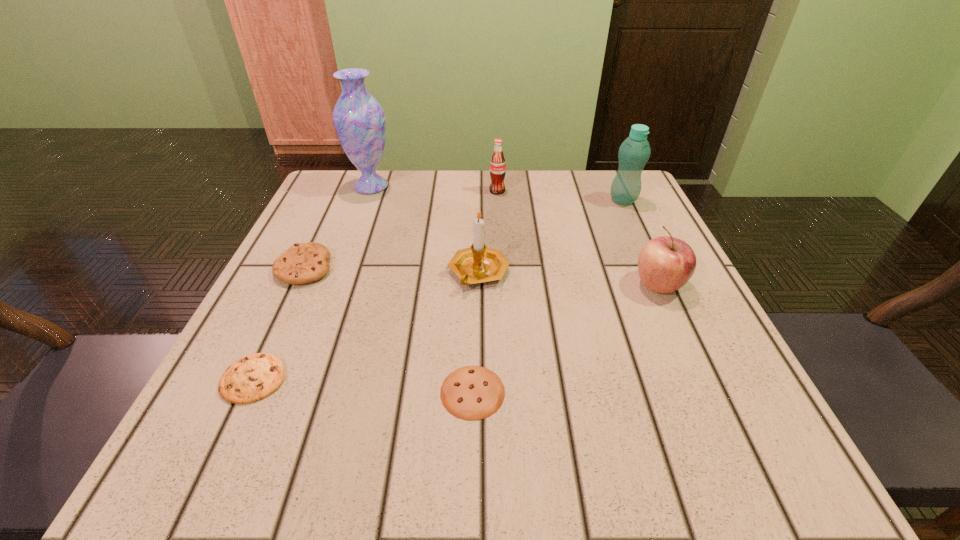
This screenshot has width=960, height=540. Find the location of `free region located 0.130m on the right of the vase`. free region located 0.130m on the right of the vase is located at coordinates (448, 186).

I want to click on vacant area located 0.100m at the front cap of the second tallest object, so click(x=638, y=234).

Where is `free space located 0.300m on the front of the candle holder`? The width and height of the screenshot is (960, 540). free space located 0.300m on the front of the candle holder is located at coordinates pyautogui.click(x=478, y=462).

Identify the location of vacant space situated 0.060m on the front of the soda. (498, 209).

Locate an element on the screen. The image size is (960, 540). free space located 0.210m on the left of the apple is located at coordinates (516, 285).

At what (x,y) coordinates should I click in order to perform the action: click on vacant space located on the front of the farthest cookie. Please return your answer as a coordinate pair (x, y). Looking at the image, I should click on (277, 326).

I want to click on blank area located on the back of the seventh tallest object, so pyautogui.click(x=318, y=242).

The image size is (960, 540). What are the coordinates of `vacant area located 0.310m on the back of the shortest cookie` in the screenshot? It's located at (475, 242).

Find the location of a particular element. The height and width of the screenshot is (540, 960). vase located in the far edge section of the desktop is located at coordinates (359, 120).

Find the location of a particular element. water bottle that is at the far edge is located at coordinates (634, 152).